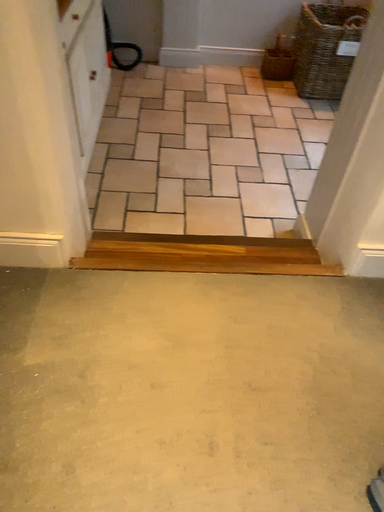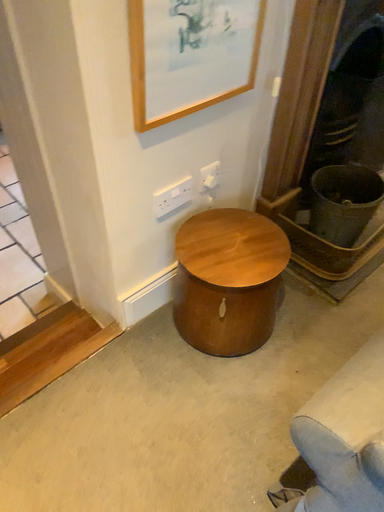
Question: How did the camera likely rotate when shooting the video?

Choices:
 (A) rotated left
 (B) rotated right

Answer: (B)